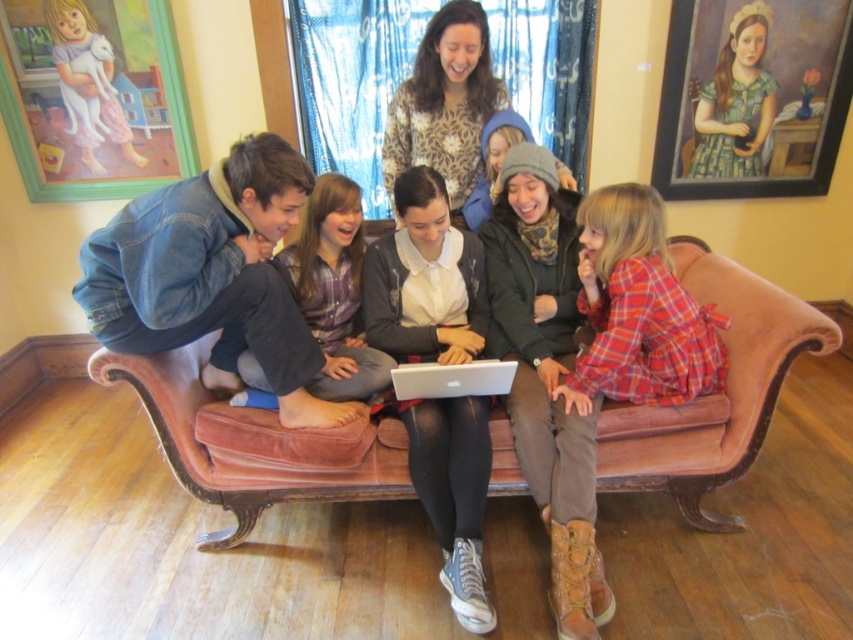
Question: Which point appears closest to the camera in this image?

Choices:
 (A) (393, 492)
 (B) (718, 176)

Answer: (A)

Question: Can you confirm if pink velvet couch at center is positioned below plaid fabric dress at center?

Choices:
 (A) no
 (B) yes

Answer: (B)

Question: Which of the following is the closest to the observer?

Choices:
 (A) (36, 202)
 (B) (480, 83)
 (C) (482, 385)

Answer: (C)

Question: Which object appears closest to the camera in this image?

Choices:
 (A) plaid fabric dress at center
 (B) wooden frame at upper left
 (C) pink velvet couch at center

Answer: (C)

Question: From the image, what is the correct spatial relationship of wooden framed portrait at upper right in relation to wooden frame at upper left?

Choices:
 (A) right
 (B) left

Answer: (A)

Question: Does pink velvet couch at center appear on the left side of silver metallic laptop at center?

Choices:
 (A) yes
 (B) no

Answer: (B)